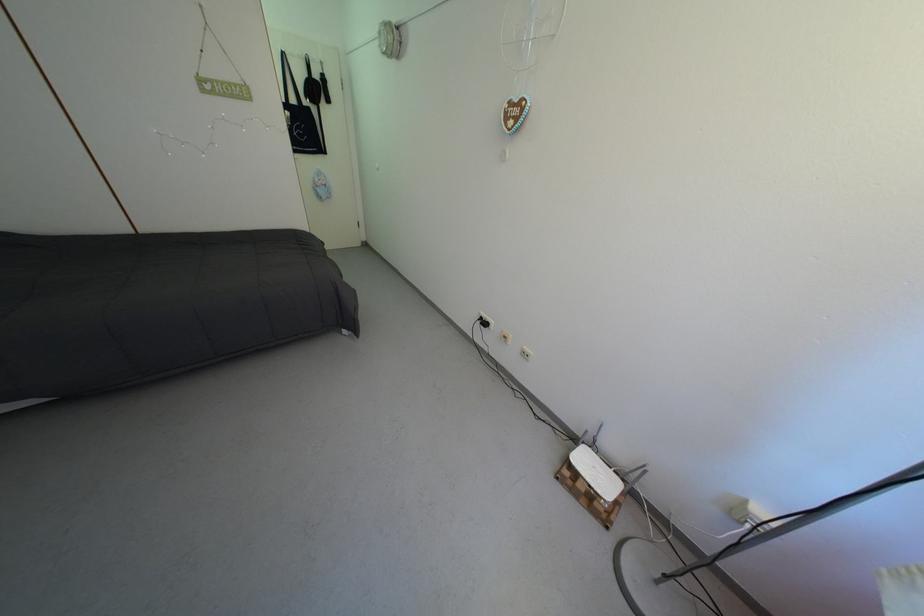
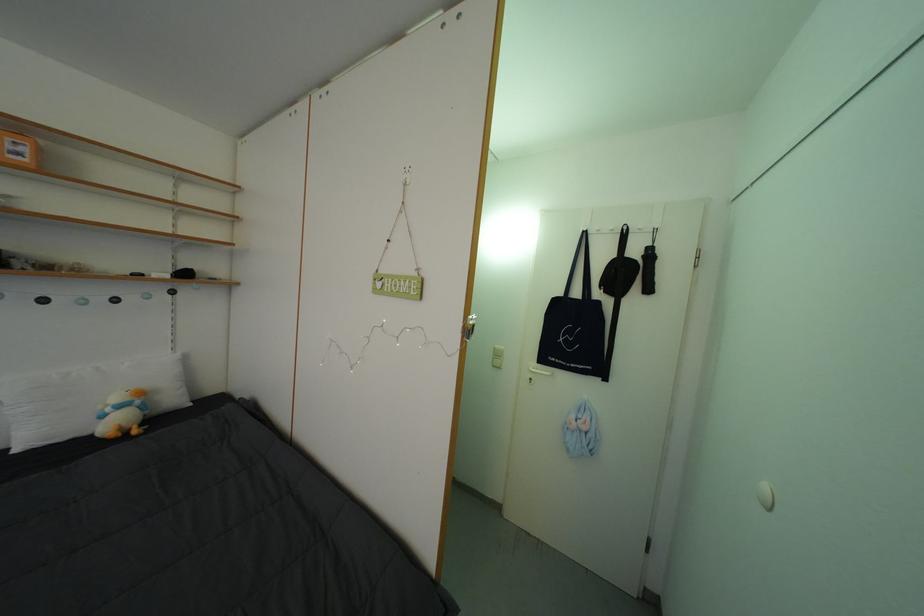
In the second image, find the point that corresponds to point 324,82 in the first image.

(642, 257)